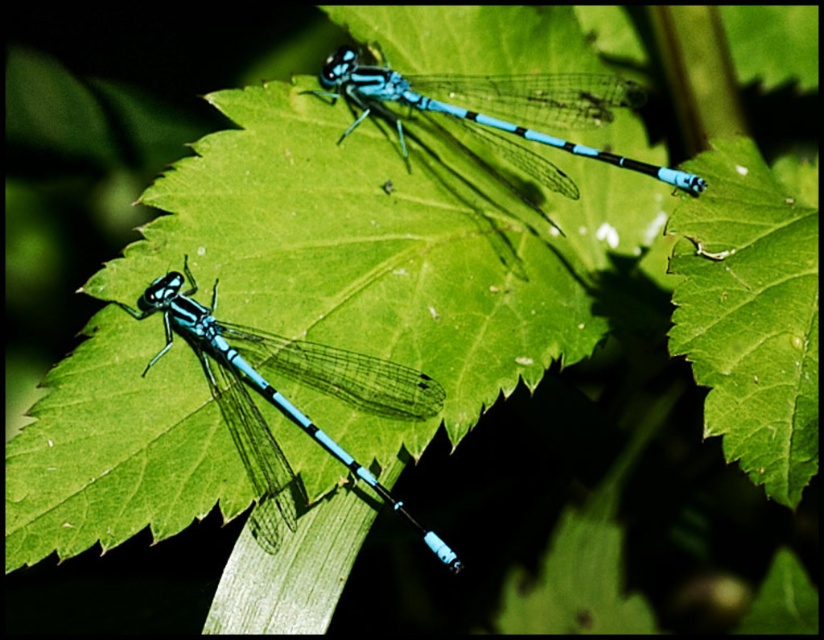
Question: Is green matte leaf at upper right to the right of translucent blue dragonfly at lower left from the viewer's perspective?

Choices:
 (A) yes
 (B) no

Answer: (A)

Question: Does green matte leaf at upper right appear over blue glossy dragonfly at upper center?

Choices:
 (A) no
 (B) yes

Answer: (A)

Question: Which point is farther from the camera taking this photo?

Choices:
 (A) (473, 80)
 (B) (162, 348)

Answer: (A)

Question: Which object appears farthest from the camera in this image?

Choices:
 (A) green matte leaf at upper right
 (B) translucent blue dragonfly at lower left
 (C) blue glossy dragonfly at upper center

Answer: (C)

Question: Which object is farther from the camera taking this photo?

Choices:
 (A) translucent blue dragonfly at lower left
 (B) green matte leaf at upper right

Answer: (A)

Question: Observing the image, what is the correct spatial positioning of translucent blue dragonfly at lower left in reference to blue glossy dragonfly at upper center?

Choices:
 (A) left
 (B) right

Answer: (A)